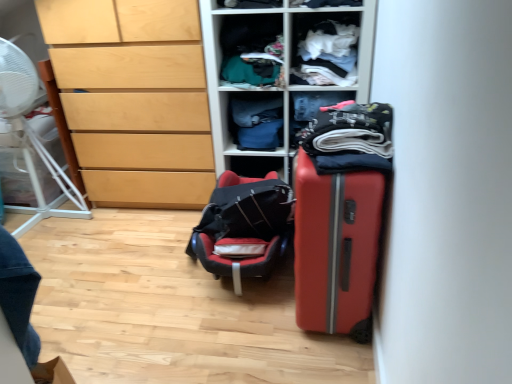
Identify the location of vacant space that is in between white plastic fan at left and black fabric backpack at center. (122, 248).